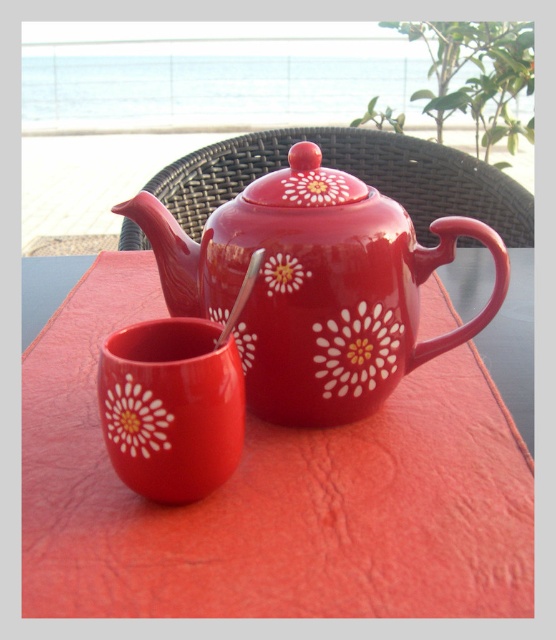
Can you confirm if glossy ceramic table at center is wider than matte ceramic mug at lower left?

Yes, glossy ceramic table at center is wider than matte ceramic mug at lower left.

Looking at this image, does glossy ceramic table at center have a larger size compared to matte ceramic mug at lower left?

Yes.

Is point (522, 444) less distant than point (186, 490)?

That is False.

This screenshot has height=640, width=556. Find the location of `glossy ceramic table at center`. glossy ceramic table at center is located at coordinates (272, 496).

Who is positioned more to the left, matte ceramic teapot at center or matte ceramic mug at lower left?

matte ceramic mug at lower left is more to the left.

Can you confirm if matte ceramic teapot at center is thinner than matte ceramic mug at lower left?

No.

Does point (464, 225) come behind point (112, 403)?

Yes, it is.

At what (x,y) coordinates should I click in order to perform the action: click on matte ceramic teapot at center. Please return your answer as a coordinate pair (x, y). Looking at the image, I should click on (315, 285).

Find the location of `glossy ceramic table at center`. glossy ceramic table at center is located at coordinates (272, 496).

Is point (433, 529) closer to camera compared to point (315, 202)?

Yes, point (433, 529) is in front of point (315, 202).

Between point (456, 486) and point (272, 410), which one is positioned behind?

Point (272, 410)

Locate an element on the screen. Image resolution: width=556 pixels, height=640 pixels. glossy ceramic table at center is located at coordinates (272, 496).